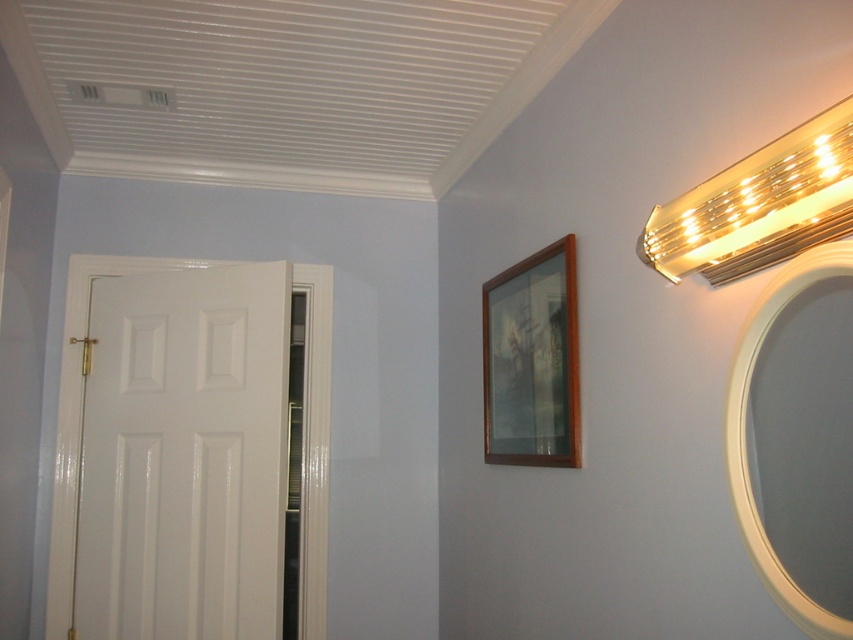
Question: Does gold metallic light fixture at upper right have a larger size compared to white glossy mirror at upper right?

Choices:
 (A) no
 (B) yes

Answer: (B)

Question: Which of the following is the farthest from the observer?

Choices:
 (A) (845, 100)
 (B) (508, 310)
 (C) (726, 444)

Answer: (B)

Question: Which of the following is the closest to the observer?

Choices:
 (A) (759, 548)
 (B) (671, 262)
 (C) (560, 401)

Answer: (A)

Question: Observing the image, what is the correct spatial positioning of gold metallic light fixture at upper right in reference to white glossy mirror at upper right?

Choices:
 (A) below
 (B) above

Answer: (B)

Question: Which is nearer to the white glossy mirror at upper right?

Choices:
 (A) wooden picture frame at upper right
 (B) gold metallic light fixture at upper right

Answer: (B)

Question: Is the position of gold metallic light fixture at upper right more distant than that of white glossy mirror at upper right?

Choices:
 (A) no
 (B) yes

Answer: (A)